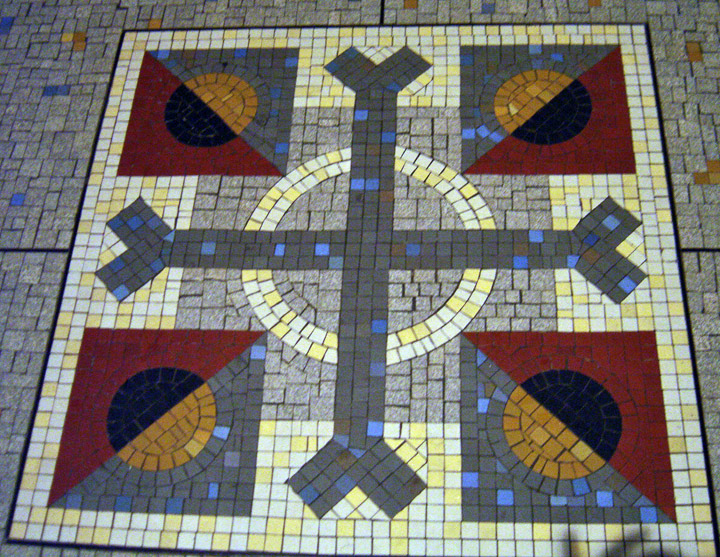
At what (x,y) coordinates should I click in order to perform the action: click on mosaic artwork. Please return your answer as a coordinate pair (x, y). The width and height of the screenshot is (720, 557). Looking at the image, I should click on (616, 335).